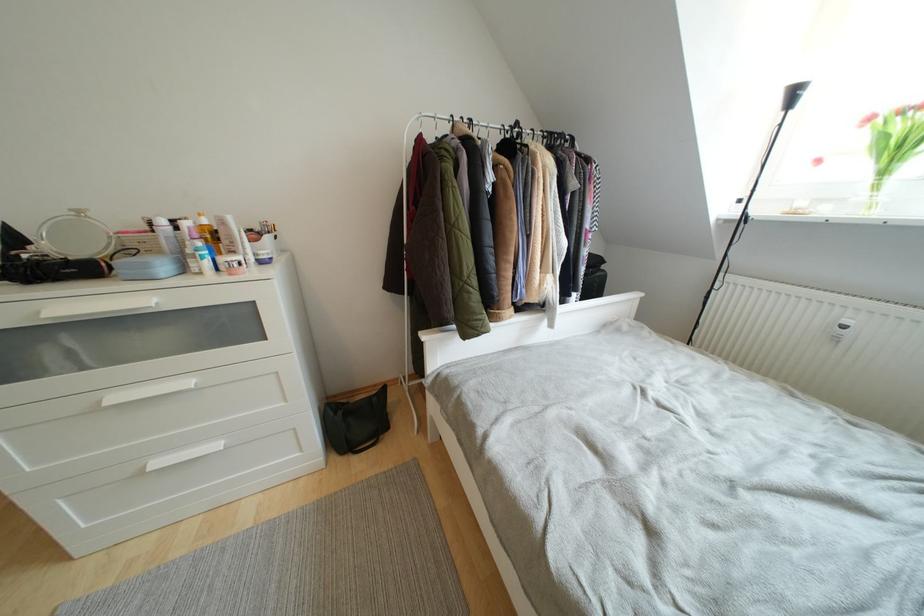
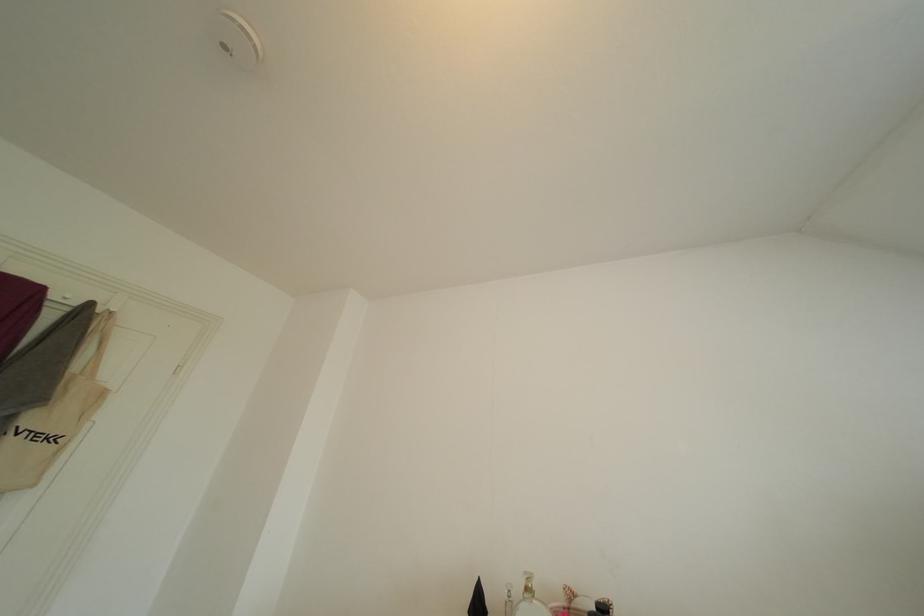
Looking at this image, how did the camera likely rotate?

The camera's rotation is toward left-up.